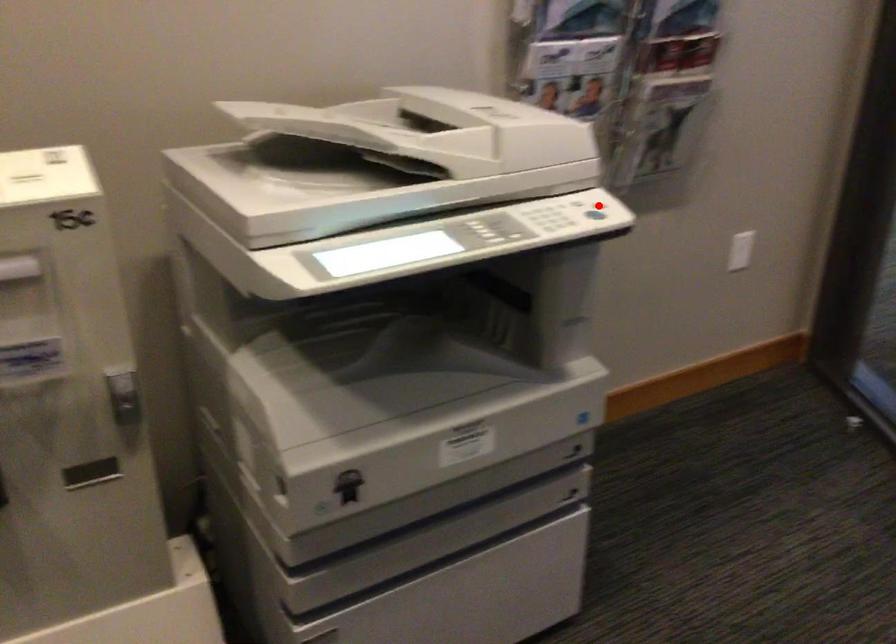
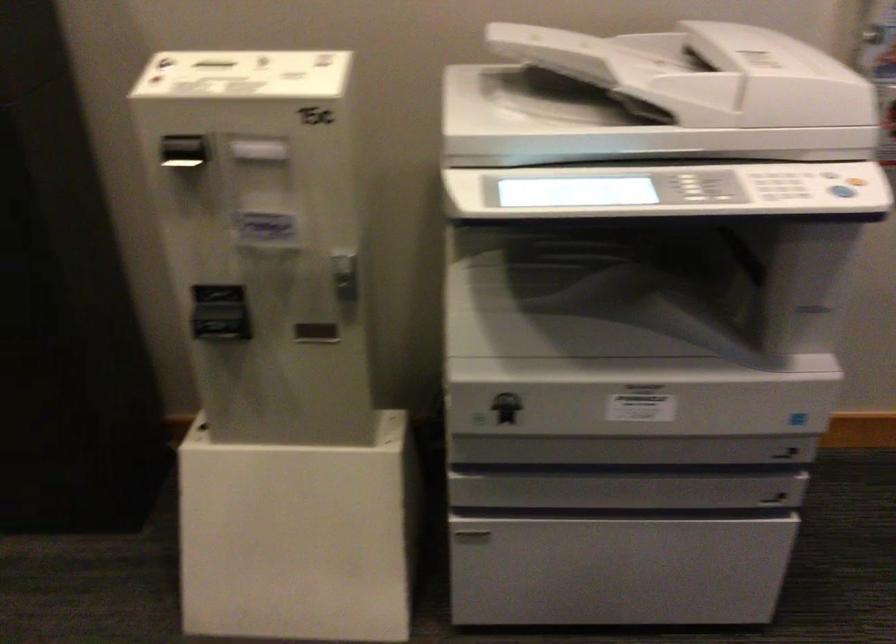
Where in the second image is the point corresponding to the highlighted location from the first image?

(855, 181)